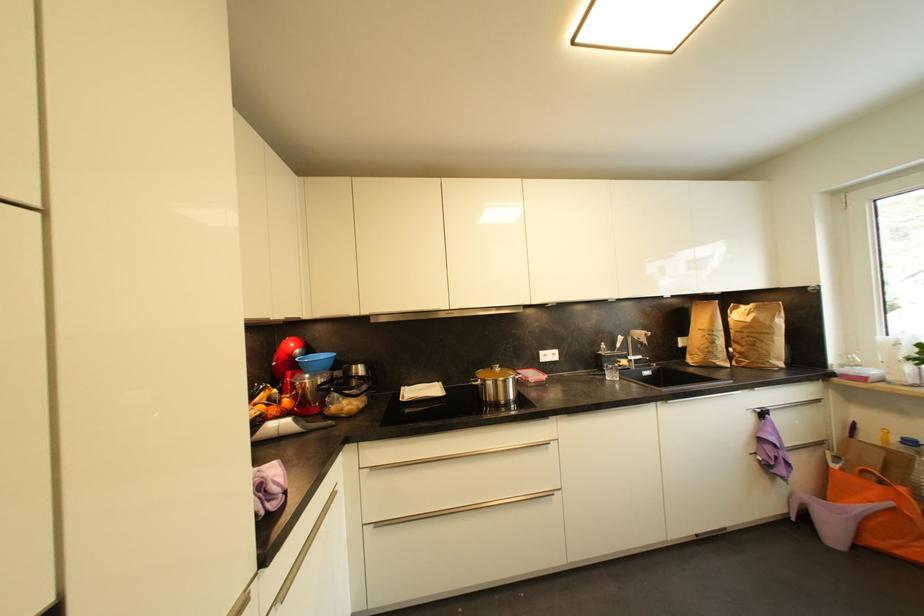
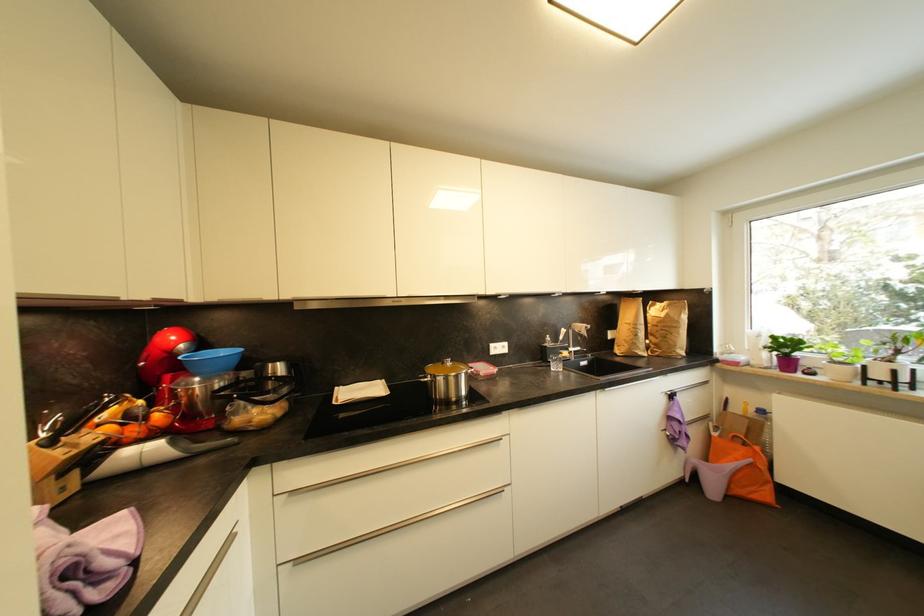
Question: The camera is either moving clockwise (left) or counter-clockwise (right) around the object. The first image is from the beginning of the video and the second image is from the end. Is the camera moving left or right when shooting the video?

Choices:
 (A) Left
 (B) Right

Answer: (A)